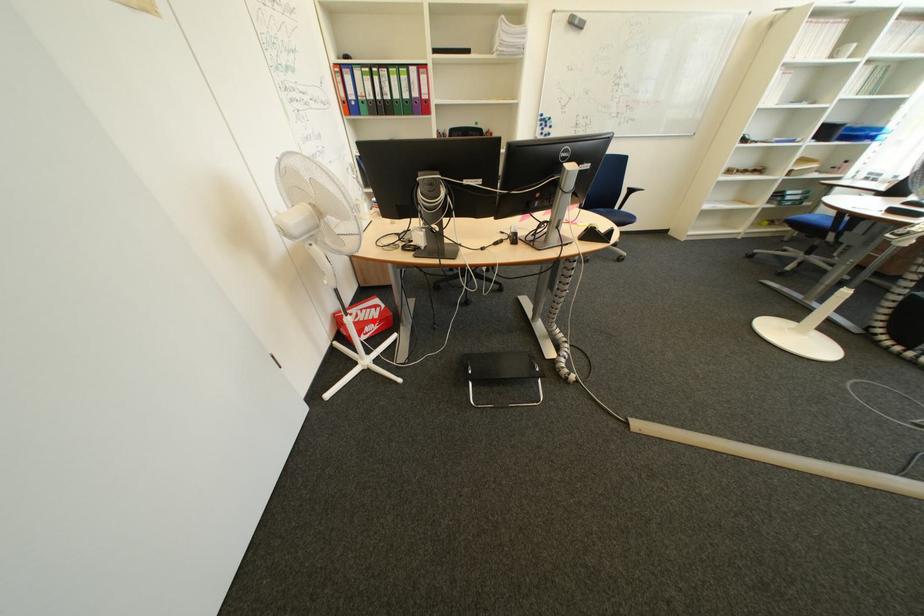
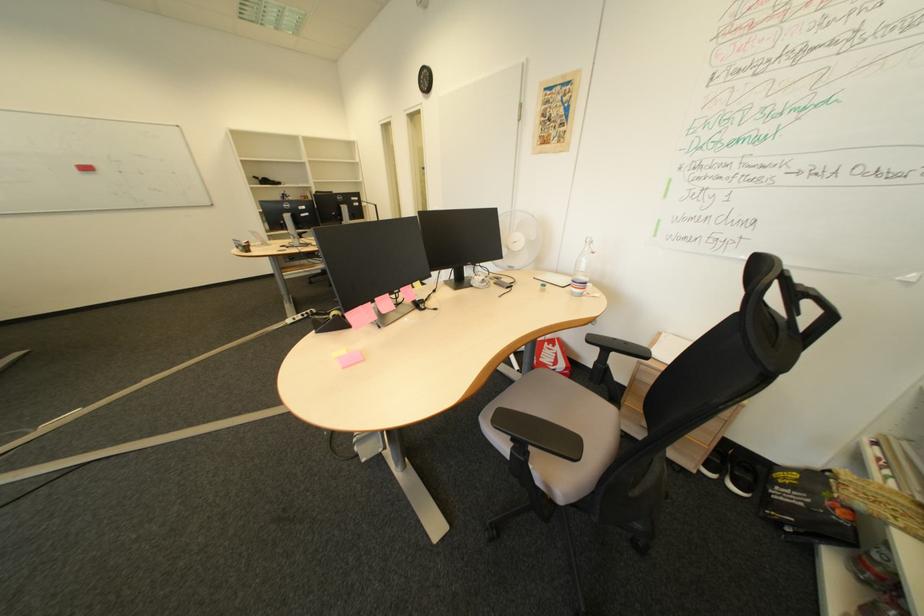
The point at the highlighted location is marked in the first image. Where is the corresponding point in the second image?

(556, 351)